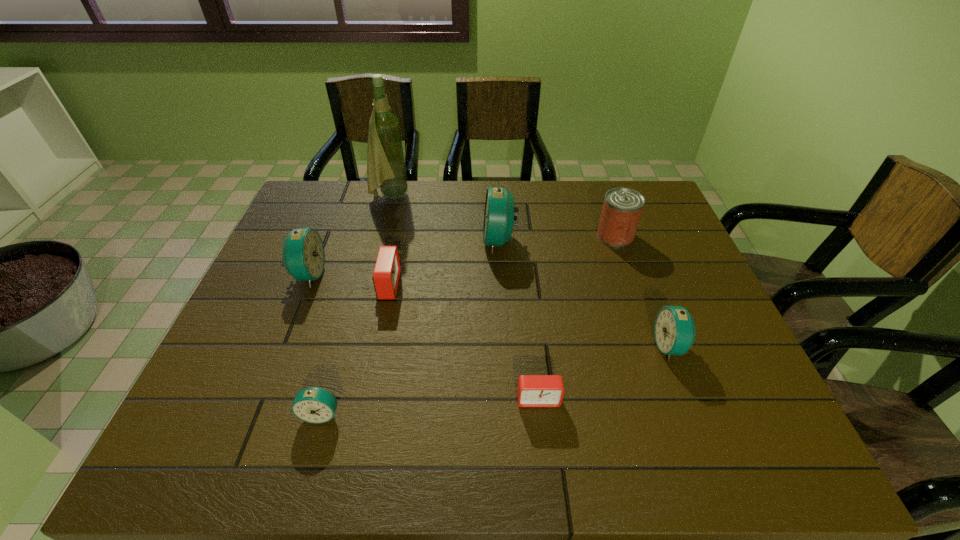
Find the location of `the farther red alarm clock`. the farther red alarm clock is located at coordinates (386, 274).

Locate an element on the screen. The width and height of the screenshot is (960, 540). the smallest blue alarm clock is located at coordinates (316, 405).

Where is `the second blue alarm clock from left to right`? the second blue alarm clock from left to right is located at coordinates (316, 405).

Locate an element on the screen. Image resolution: width=960 pixels, height=540 pixels. the right red alarm clock is located at coordinates coord(532,390).

Where is `the nearer red alarm clock`? The width and height of the screenshot is (960, 540). the nearer red alarm clock is located at coordinates click(532, 390).

Locate an element on the screen. The image size is (960, 540). blank space located 0.220m on the front-facing side of the farthest object is located at coordinates (474, 196).

Locate an element on the screen. The width and height of the screenshot is (960, 540). free region located 0.290m on the front-facing side of the biggest blue alarm clock is located at coordinates (385, 241).

This screenshot has height=540, width=960. What are the coordinates of `vacant region located 0.330m on the front-facing side of the biggest blue alarm clock` in the screenshot? It's located at (372, 241).

The width and height of the screenshot is (960, 540). In order to click on vacant space situated 0.310m on the front-facing side of the biggest blue alarm clock in this screenshot , I will do pos(378,241).

Find the location of a particular element. This screenshot has height=540, width=960. vacant space situated 0.300m on the front-facing side of the leftmost blue alarm clock is located at coordinates (434, 274).